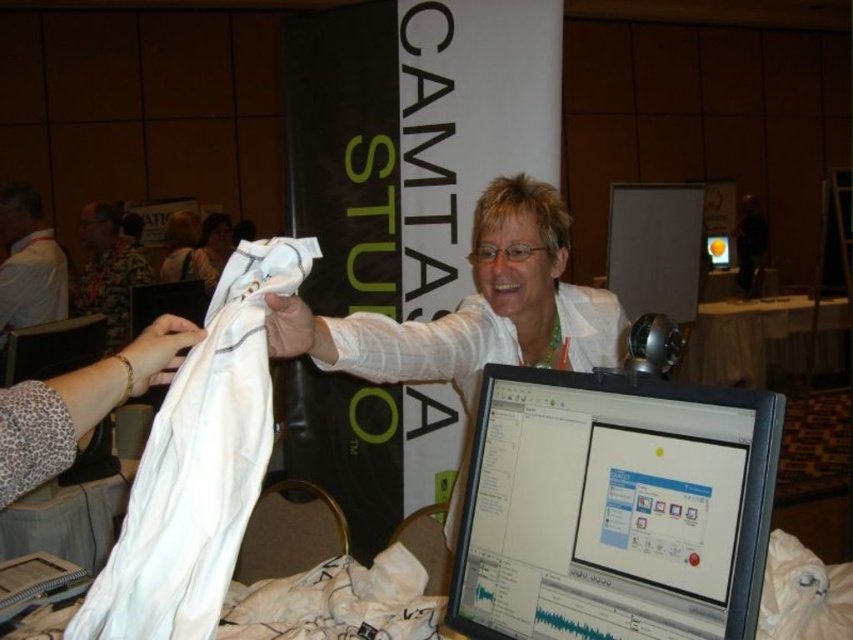
You are an attendee at the trade show and you want to compare the sizes of the white fabric at lower right and the matte black monitor at center. Which one is wider?

The white fabric at lower right is wider than the matte black monitor at center.

You are attending a trade show and want to take a photo of the white cotton shirt at center and the matte black monitor at center. Which object should you focus on first to ensure both are in clear view?

The white cotton shirt at center is closer to the viewer than the matte black monitor at center. To ensure both are in clear view, focus on the white cotton shirt at center first, as it is closer, and adjust the camera to include the matte black monitor at center in the background.